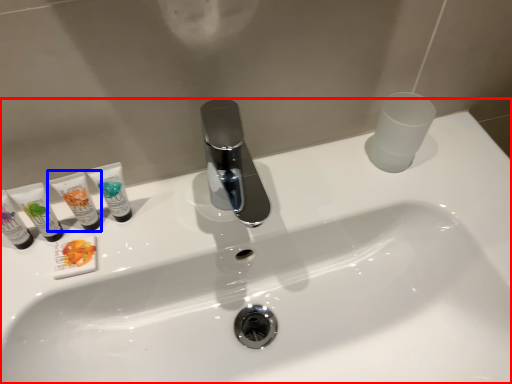
Question: Which object is closer to the camera taking this photo, sink (highlighted by a red box) or toiletry (highlighted by a blue box)?

Choices:
 (A) sink
 (B) toiletry

Answer: (A)